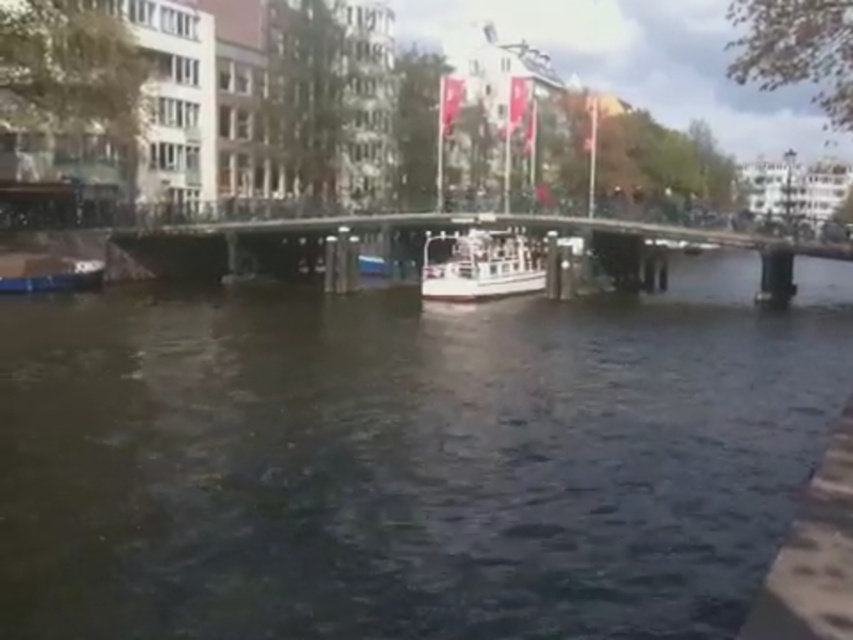
You are a boat captain navigating a narrow canal. Your boat is 2 meters tall. You see the dark water at center and the white painted steel bridge at center in the scene. Can your boat pass under the bridge without hitting it?

The dark water at center is taller than the white painted steel bridge at center, which means the bridge is lower than the water level. Since your boat is 2 meters tall, it cannot pass under the bridge as the bridge is below the water level and obstructs passage.

You are a photographer trying to capture the white glossy boat at center in the reflection of the dark water at center. Based on the scene, will the boat be fully visible in the water reflection?

The dark water at center is taller than white glossy boat at center, so the boat will be fully visible in its reflection since the water surface can mirror the entire height of the boat.

You are a tourist standing on the bridge and want to take a photo of the white glossy boat at center and the dark water at center. Which object should you point your camera downward to capture?

You should point your camera downward to capture the dark water at center, as it is located below the white glossy boat at center.